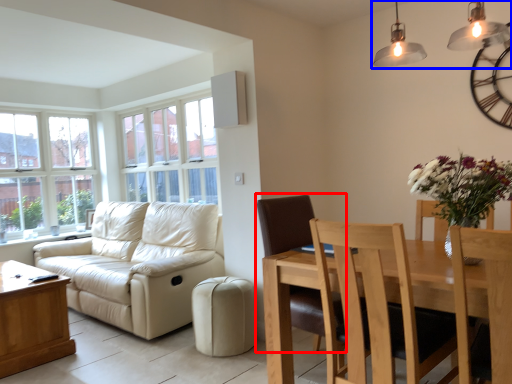
Question: Among these objects, which one is farthest to the camera, chair (highlighted by a red box) or lamp (highlighted by a blue box)?

Choices:
 (A) chair
 (B) lamp

Answer: (A)